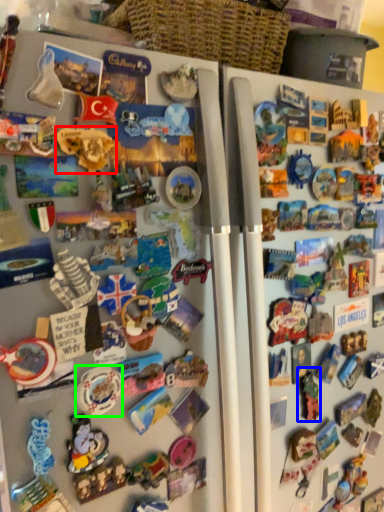
Question: Considering the real-world distances, which object is farthest from toy (highlighted by a red box)? toy (highlighted by a blue box) or toy (highlighted by a green box)?

Choices:
 (A) toy
 (B) toy

Answer: (A)